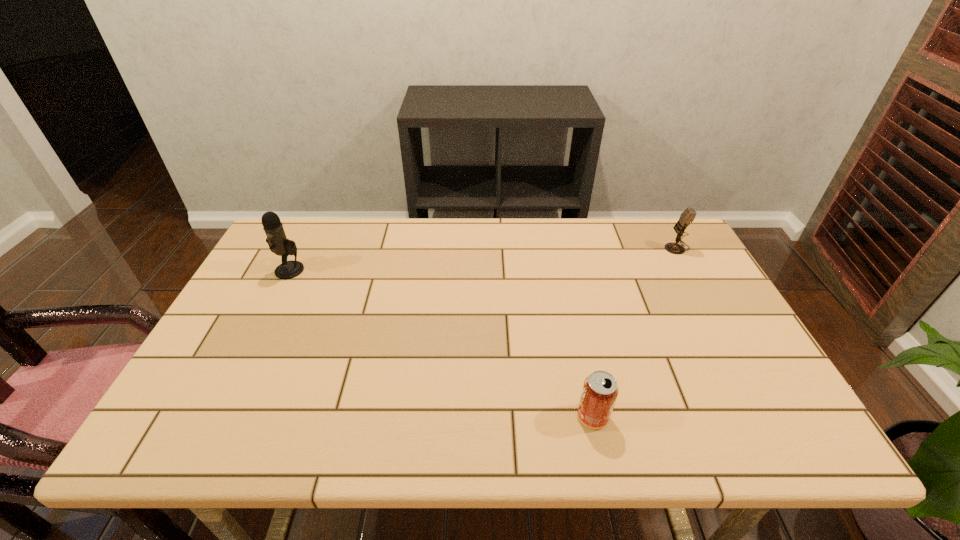
You are a GUI agent. You are given a task and a screenshot of the screen. Output one action in this format:
    pyautogui.click(x=<x>, y=<y>)
    Task: Click on the taller microphone
    
    Given the screenshot: What is the action you would take?
    pyautogui.click(x=278, y=243)

Identify the location of the left microphone. (278, 243).

Where is `the farthest object`? The image size is (960, 540). the farthest object is located at coordinates (687, 217).

Find the location of `the rightmost object`. the rightmost object is located at coordinates (687, 217).

The height and width of the screenshot is (540, 960). I want to click on the shortest object, so click(600, 390).

Find the location of a particular element. the nearest object is located at coordinates (600, 390).

What are the coordinates of `vacant space located on the front of the leftmost object` in the screenshot? It's located at (273, 303).

Locate an element on the screen. free spot located 0.060m on the front-facing side of the farther microphone is located at coordinates (645, 247).

Identify the location of free region located on the front-facing side of the farther microphone. The image size is (960, 540). (601, 247).

This screenshot has width=960, height=540. What are the coordinates of `vacant space located on the front-facing side of the farther microphone` in the screenshot? It's located at (541, 247).